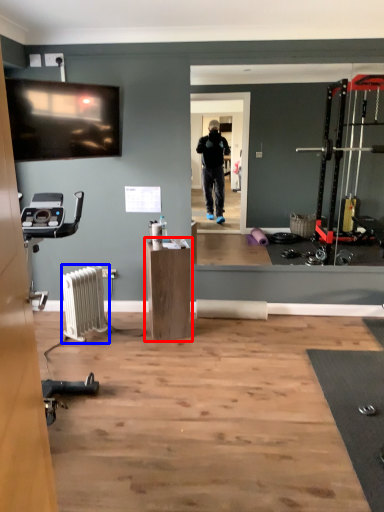
Question: Which object is closer to the camera taking this photo, furniture (highlighted by a red box) or radiator (highlighted by a blue box)?

Choices:
 (A) furniture
 (B) radiator

Answer: (B)